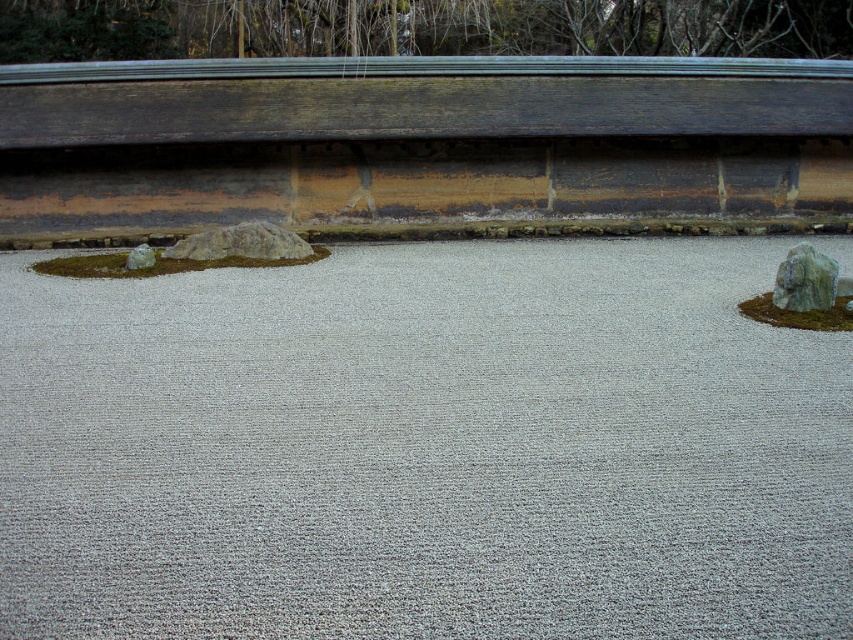
You are standing in the Japanese rock garden and want to place a small decorative stone. You notice the gray gravel at center located at point (424,448). Is this location suitable for placing the stone without obstructing the existing patterns in the gravel?

The gray gravel at center is located at point (424,448), which is part of the existing gravel patterns. Placing a stone here would disrupt the current design, so it is not recommended.

You are a gardener who needs to place a 20 feet long hose between the green moss at left and the green mossy rock at right. Can you fit the hose between them without bending it?

The distance between the green moss at left and the green mossy rock at right is 26.04 feet, which is longer than the 20 feet hose. Therefore, the hose can be placed straight between them without bending.

You are standing in the Japanese rock garden and want to walk from the wooden structure to the gravel area. There are two points marked in the garden, point 1 at coordinates point (x=61, y=262) and point 2 at coordinates point (x=793, y=308). Which point is closer to the wooden structure?

Point (x=61, y=262) is behind point (x=793, y=308), so the closer point to the wooden structure is point (x=793, y=308).